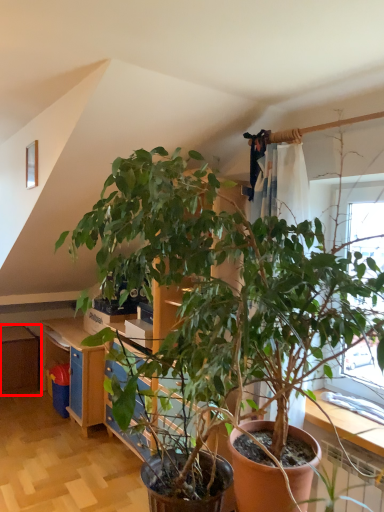
Question: In this image, where is dresser (annotated by the red box) located relative to dresser?

Choices:
 (A) right
 (B) left

Answer: (B)